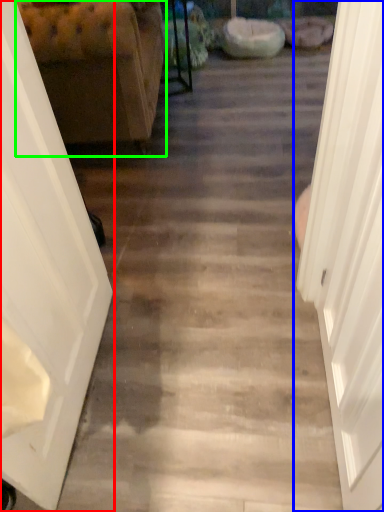
Question: Which is nearer to the door (highlighted by a red box)? door (highlighted by a blue box) or furniture (highlighted by a green box).

Choices:
 (A) door
 (B) furniture

Answer: (A)